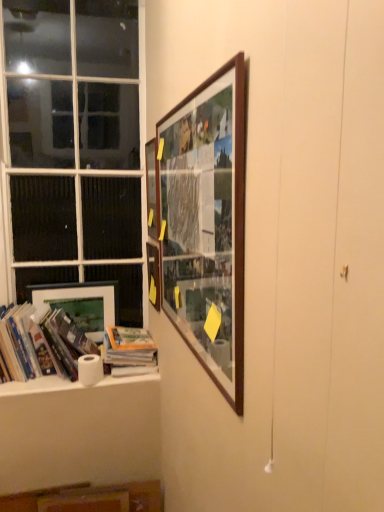
Question: Should I look upward or downward to see white paper towel at lower left?

Choices:
 (A) up
 (B) down

Answer: (B)

Question: Is wooden picture frame at upper center, which is counted as the fourth picture frame, starting from the left, facing towards wooden frame at upper center, the 2th picture frame when ordered from right to left?

Choices:
 (A) no
 (B) yes

Answer: (A)

Question: From a real-world perspective, does wooden picture frame at upper center, marked as the 1th picture frame in a front-to-back arrangement, stand above wooden frame at upper center, the 2th picture frame when ordered from right to left?

Choices:
 (A) yes
 (B) no

Answer: (B)

Question: Does wooden picture frame at upper center, marked as the 1th picture frame in a front-to-back arrangement, touch wooden frame at upper center, which is the second picture frame from front to back?

Choices:
 (A) no
 (B) yes

Answer: (A)

Question: Is wooden picture frame at upper center, which is counted as the fourth picture frame, starting from the left, positioned before wooden frame at upper center, which is the second picture frame from front to back?

Choices:
 (A) yes
 (B) no

Answer: (A)

Question: Is wooden picture frame at upper center, which is the 4th picture frame in back-to-front order, smaller than wooden frame at upper center, positioned as the 3th picture frame in left-to-right order?

Choices:
 (A) yes
 (B) no

Answer: (B)

Question: Would you say wooden frame at upper center, positioned as the 3th picture frame in left-to-right order, is part of wooden picture frame at upper center, marked as the 1th picture frame in a front-to-back arrangement,'s contents?

Choices:
 (A) no
 (B) yes

Answer: (A)

Question: Does wooden cabinet at lower center appear on the left side of matte wooden picture frame at lower left, marked as the 1th picture frame in a left-to-right arrangement?

Choices:
 (A) no
 (B) yes

Answer: (A)

Question: Is wooden cabinet at lower center positioned with its back to matte wooden picture frame at lower left, the first picture frame from the back?

Choices:
 (A) yes
 (B) no

Answer: (B)

Question: Is wooden cabinet at lower center smaller than matte wooden picture frame at lower left, marked as the 1th picture frame in a left-to-right arrangement?

Choices:
 (A) no
 (B) yes

Answer: (A)

Question: Considering the relative sizes of wooden cabinet at lower center and matte wooden picture frame at lower left, marked as the 1th picture frame in a left-to-right arrangement, in the image provided, is wooden cabinet at lower center wider than matte wooden picture frame at lower left, marked as the 1th picture frame in a left-to-right arrangement,?

Choices:
 (A) yes
 (B) no

Answer: (A)

Question: From a real-world perspective, does wooden cabinet at lower center sit lower than matte wooden picture frame at lower left, the first picture frame from the back?

Choices:
 (A) no
 (B) yes

Answer: (B)

Question: From the image's perspective, is wooden cabinet at lower center located above matte wooden picture frame at lower left, marked as the 1th picture frame in a left-to-right arrangement?

Choices:
 (A) no
 (B) yes

Answer: (A)

Question: Does hardcover books at left, placed as the first book when sorted from left to right, touch wooden picture frame at upper center, marked as the 1th picture frame in a front-to-back arrangement?

Choices:
 (A) no
 (B) yes

Answer: (A)